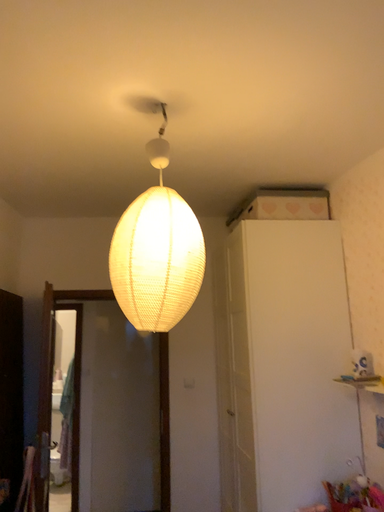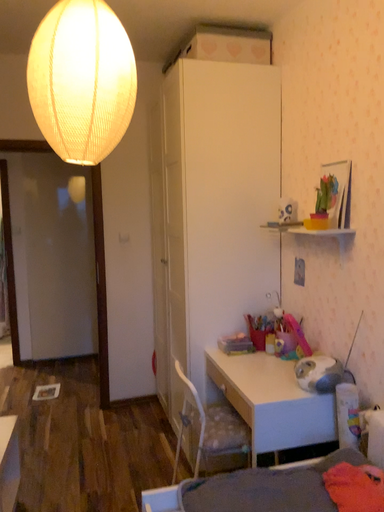
Question: Which way did the camera rotate in the video?

Choices:
 (A) rotated upward
 (B) rotated downward

Answer: (B)